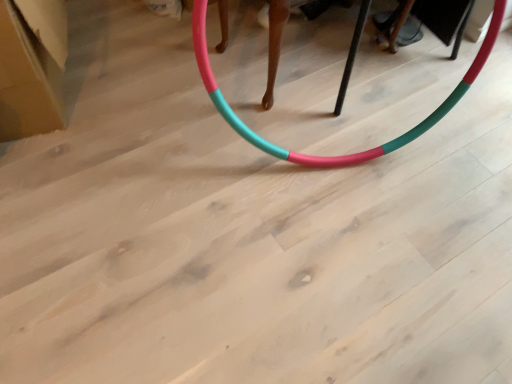
Question: From the image's perspective, is teal matte hula hoop at center below white cardboard box at upper left?

Choices:
 (A) yes
 (B) no

Answer: (A)

Question: Is teal matte hula hoop at center not near white cardboard box at upper left?

Choices:
 (A) no
 (B) yes

Answer: (A)

Question: Does teal matte hula hoop at center appear on the left side of white cardboard box at upper left?

Choices:
 (A) yes
 (B) no

Answer: (B)

Question: Does teal matte hula hoop at center appear on the right side of white cardboard box at upper left?

Choices:
 (A) yes
 (B) no

Answer: (A)

Question: From a real-world perspective, is teal matte hula hoop at center physically below white cardboard box at upper left?

Choices:
 (A) yes
 (B) no

Answer: (B)

Question: Is teal matte hula hoop at center turned away from white cardboard box at upper left?

Choices:
 (A) no
 (B) yes

Answer: (A)

Question: Can you confirm if white cardboard box at upper left is taller than teal matte hula hoop at center?

Choices:
 (A) yes
 (B) no

Answer: (B)

Question: Is white cardboard box at upper left to the right of teal matte hula hoop at center from the viewer's perspective?

Choices:
 (A) yes
 (B) no

Answer: (B)

Question: Does white cardboard box at upper left have a greater width compared to teal matte hula hoop at center?

Choices:
 (A) no
 (B) yes

Answer: (B)

Question: Is white cardboard box at upper left not within teal matte hula hoop at center?

Choices:
 (A) no
 (B) yes

Answer: (B)

Question: Is white cardboard box at upper left positioned in front of teal matte hula hoop at center?

Choices:
 (A) yes
 (B) no

Answer: (B)

Question: From the image's perspective, is white cardboard box at upper left under teal matte hula hoop at center?

Choices:
 (A) yes
 (B) no

Answer: (B)

Question: Is teal matte hula hoop at center wider or thinner than white cardboard box at upper left?

Choices:
 (A) thin
 (B) wide

Answer: (A)